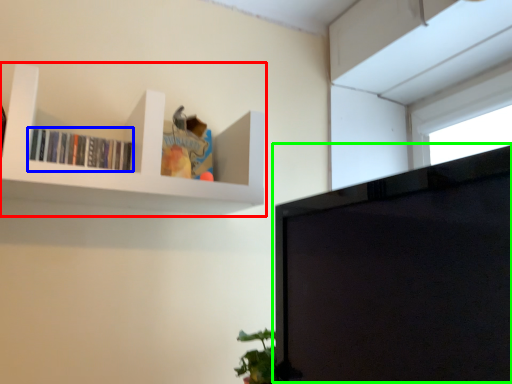
Question: Considering the real-world distances, which object is closest to shelf (highlighted by a red box)? book (highlighted by a blue box) or computer monitor (highlighted by a green box).

Choices:
 (A) book
 (B) computer monitor

Answer: (A)